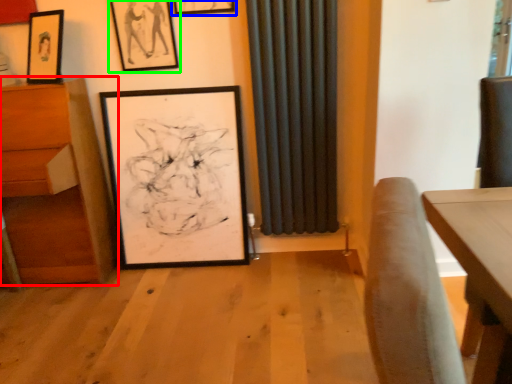
Question: Considering the real-world distances, which object is farthest from furniture (highlighted by a red box)? picture frame (highlighted by a blue box) or picture frame (highlighted by a green box)?

Choices:
 (A) picture frame
 (B) picture frame

Answer: (A)